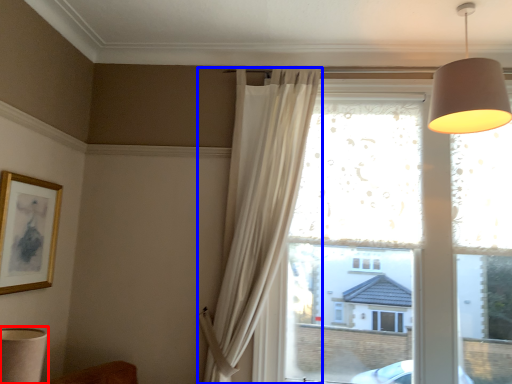
Question: Which of the following is the farthest to the observer, table lamp (highlighted by a red box) or curtain (highlighted by a blue box)?

Choices:
 (A) table lamp
 (B) curtain

Answer: (B)